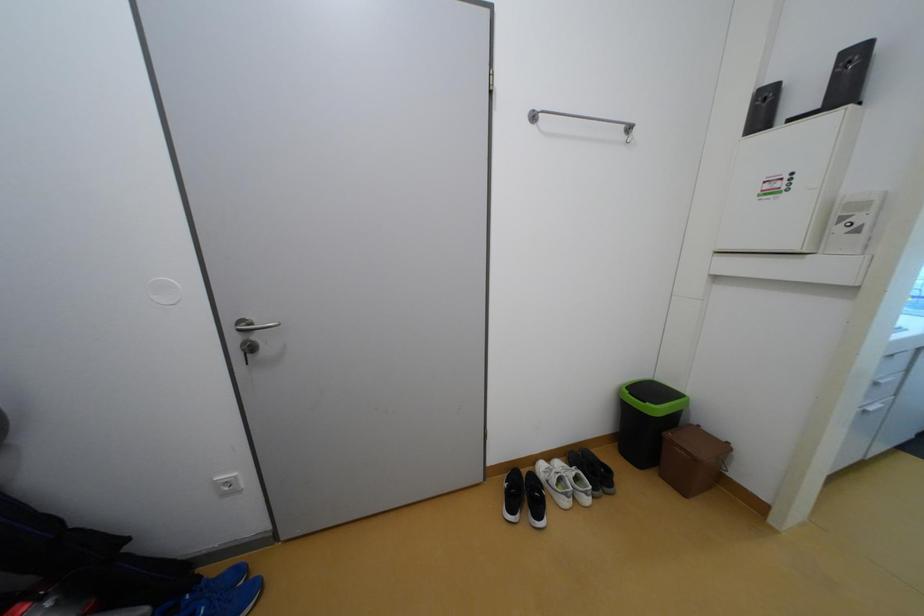
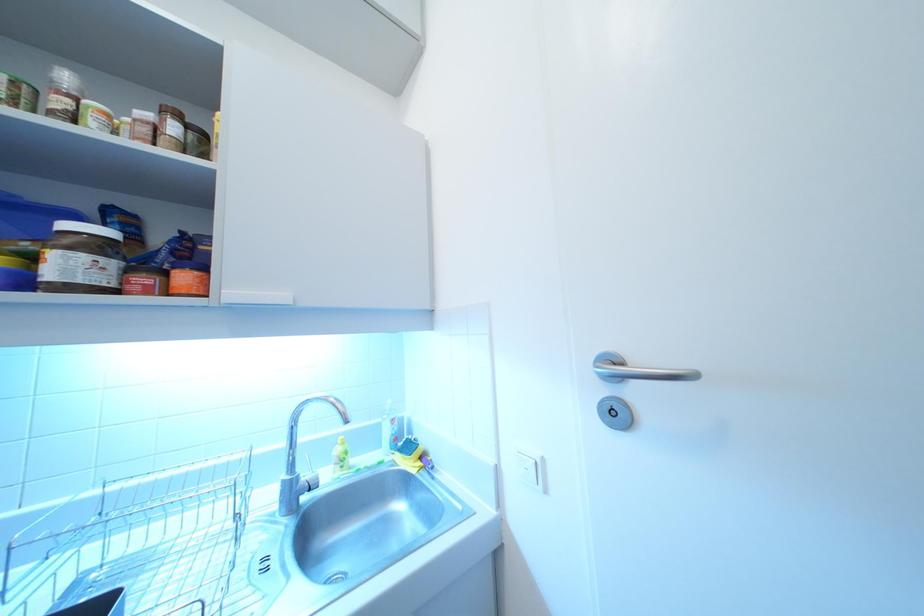
Question: What movement of the cameraman would produce the second image?

Choices:
 (A) Left
 (B) Right
 (C) Forward
 (D) Backward

Answer: (B)